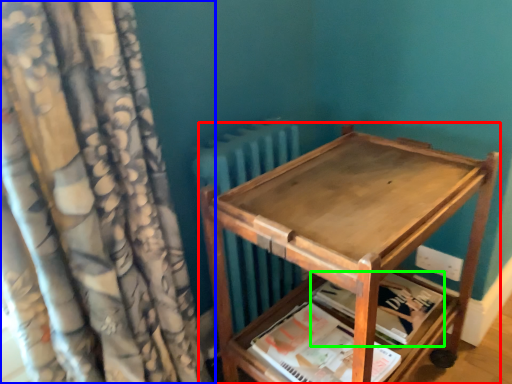
Question: Considering the real-world distances, which object is closest to furniture (highlighted by a red box)? curtain (highlighted by a blue box) or paperback book (highlighted by a green box).

Choices:
 (A) curtain
 (B) paperback book

Answer: (B)